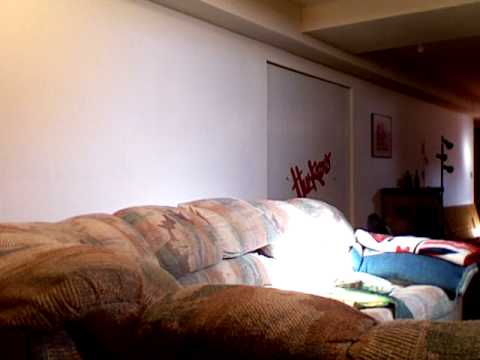
At what (x,y) coordinates should I click in order to perform the action: click on left wall. Please return your answer as a coordinate pair (x, y). This screenshot has height=360, width=480. Looking at the image, I should click on (170, 104).